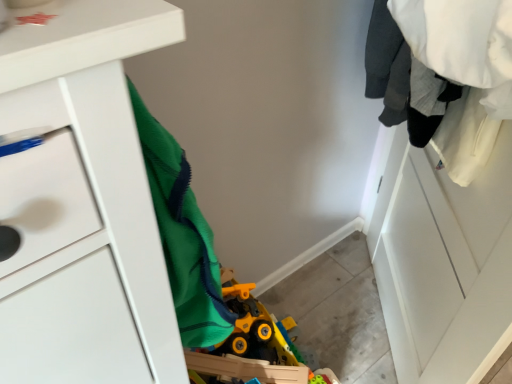
The image size is (512, 384). What do you see at coordinates (83, 201) in the screenshot?
I see `white matte chest of drawers at left` at bounding box center [83, 201].

In order to face white matte chest of drawers at left, should I rotate leftwards or rightwards?

You should look left and rotate roughly 11.629 degrees.

Find the location of a particular element. Image resolution: width=512 pixels, height=384 pixels. white matte chest of drawers at left is located at coordinates (83, 201).

Where is `white matte clothes at upper right`? The image size is (512, 384). white matte clothes at upper right is located at coordinates (444, 260).

Consider the image. Measure the distance between white matte clothes at upper right and camera.

A distance of 21.72 inches exists between white matte clothes at upper right and camera.

What do you see at coordinates (444, 260) in the screenshot? This screenshot has width=512, height=384. I see `white matte clothes at upper right` at bounding box center [444, 260].

Find the location of `white matte chest of drawers at left`. white matte chest of drawers at left is located at coordinates (83, 201).

Is white matte clothes at upper right at the left side of white matte chest of drawers at left?

No, white matte clothes at upper right is not to the left of white matte chest of drawers at left.

Considering the relative positions of white matte clothes at upper right and white matte chest of drawers at left in the image provided, is white matte clothes at upper right behind white matte chest of drawers at left?

Yes.

Which is in front, point (471, 312) or point (74, 318)?

The point (74, 318) is closer to the camera.

From the image's perspective, is white matte clothes at upper right located above or below white matte chest of drawers at left?

From the image's perspective, white matte clothes at upper right appears below white matte chest of drawers at left.

From a real-world perspective, which object rests below the other?

white matte clothes at upper right is physically lower.

Which of these two, white matte clothes at upper right or white matte chest of drawers at left, is wider?

white matte chest of drawers at left.

Considering the sizes of white matte clothes at upper right and white matte chest of drawers at left in the image, is white matte clothes at upper right taller or shorter than white matte chest of drawers at left?

In the image, white matte clothes at upper right appears to be taller than white matte chest of drawers at left.

Looking at the image, does white matte clothes at upper right seem bigger or smaller compared to white matte chest of drawers at left?

Considering their sizes, white matte clothes at upper right takes up more space than white matte chest of drawers at left.

Would you say white matte clothes at upper right is inside or outside white matte chest of drawers at left?

white matte clothes at upper right is not enclosed by white matte chest of drawers at left.

Is white matte clothes at upper right beside white matte chest of drawers at left?

No, white matte clothes at upper right is not beside white matte chest of drawers at left.

In the scene shown: Is white matte clothes at upper right turned away from white matte chest of drawers at left?

No, white matte clothes at upper right is not facing the opposite direction of white matte chest of drawers at left.

What's the angular difference between white matte clothes at upper right and white matte chest of drawers at left's facing directions?

There is a 143-degree angle between the facing directions of white matte clothes at upper right and white matte chest of drawers at left.

Find the location of a particular element. chest of drawers to the left of white matte clothes at upper right is located at coordinates (83, 201).

Which object is positioned more to the left, white matte chest of drawers at left or white matte clothes at upper right?

From the viewer's perspective, white matte chest of drawers at left appears more on the left side.

Looking at this image, between white matte chest of drawers at left and white matte clothes at upper right, which one is positioned behind?

white matte clothes at upper right is further from the camera.

Which point is more forward, (123, 250) or (456, 25)?

Positioned in front is point (123, 250).

From the image's perspective, would you say white matte chest of drawers at left is shown under white matte clothes at upper right?

No.

From a real-world perspective, who is located higher, white matte chest of drawers at left or white matte clothes at upper right?

white matte chest of drawers at left is physically above.

Considering the sizes of objects white matte chest of drawers at left and white matte clothes at upper right in the image provided, who is thinner, white matte chest of drawers at left or white matte clothes at upper right?

Thinner between the two is white matte clothes at upper right.

Which of these two, white matte chest of drawers at left or white matte clothes at upper right, stands taller?

white matte clothes at upper right is taller.

Based on their sizes in the image, would you say white matte chest of drawers at left is bigger or smaller than white matte clothes at upper right?

In the image, white matte chest of drawers at left appears to be smaller than white matte clothes at upper right.

Would you say white matte chest of drawers at left is inside or outside white matte clothes at upper right?

white matte chest of drawers at left is not enclosed by white matte clothes at upper right.

Is white matte chest of drawers at left with white matte clothes at upper right?

No, white matte chest of drawers at left is not making contact with white matte clothes at upper right.

Could you tell me if white matte chest of drawers at left is facing white matte clothes at upper right?

Yes.

This screenshot has height=384, width=512. What are the coordinates of `chest of drawers that appears on the left of white matte clothes at upper right` in the screenshot? It's located at (83, 201).

In the image, there is a white matte clothes at upper right. Where is `the chest of drawers above it (from the image's perspective)`? The image size is (512, 384). the chest of drawers above it (from the image's perspective) is located at coordinates (83, 201).

Find the location of a particular element. closet on the right of white matte chest of drawers at left is located at coordinates (444, 260).